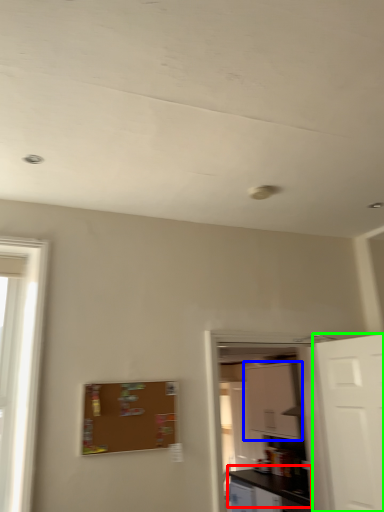
Question: Which is farther away from counter top (highlighted by a red box)? cabinetry (highlighted by a blue box) or door (highlighted by a green box)?

Choices:
 (A) cabinetry
 (B) door

Answer: (B)